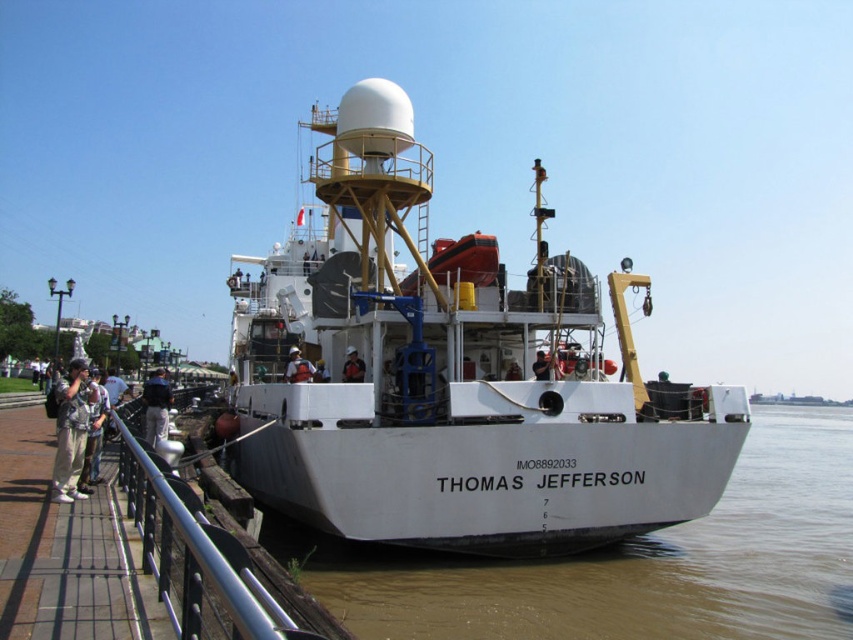
Is camouflage fabric jacket at left shorter than red fabric jacket at center?

No, camouflage fabric jacket at left is not shorter than red fabric jacket at center.

The width and height of the screenshot is (853, 640). What do you see at coordinates (71, 429) in the screenshot?
I see `camouflage fabric jacket at left` at bounding box center [71, 429].

Who is more forward, (55, 451) or (358, 378)?

Point (55, 451) is more forward.

Locate an element on the screen. camouflage fabric jacket at left is located at coordinates (71, 429).

Who is more distant from viewer, (312,294) or (347,353)?

The point (312,294) is behind.

In order to click on white matte boat at center in this screenshot , I will do `click(453, 376)`.

Between white matte boat at center and white matte helmet at center, which one is positioned higher?

white matte boat at center

Does white matte boat at center lie in front of white matte helmet at center?

Yes.

Where is `white matte boat at center`? The height and width of the screenshot is (640, 853). white matte boat at center is located at coordinates (453, 376).

Where is `white matte boat at center`? This screenshot has height=640, width=853. white matte boat at center is located at coordinates (453, 376).